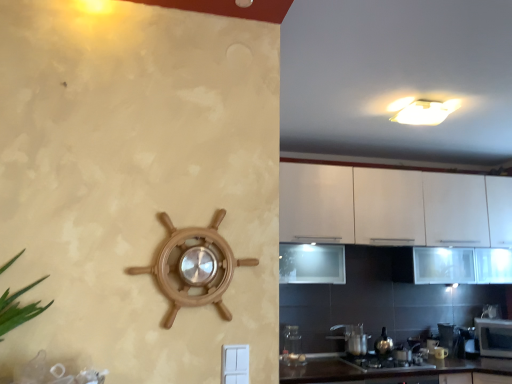
Question: Which is correct: black glossy countertop at lower center is inside transparent glass jar at lower center, arranged as the 5th appliance when viewed from the back, or outside of it?

Choices:
 (A) inside
 (B) outside

Answer: (B)

Question: From the image's perspective, is black glossy countertop at lower center located above or below transparent glass jar at lower center, arranged as the 5th appliance when viewed from the back?

Choices:
 (A) above
 (B) below

Answer: (B)

Question: Estimate the real-world distances between objects in this image. Which object is closer to the metallic silver gas stove at lower center?

Choices:
 (A) metallic silver kettle at lower right, the 3th appliance positioned from the bottom
 (B) silver metallic microwave at lower right
 (C) black glossy countertop at lower center
 (D) metallic silver toaster at lower right, the second appliance when ordered from back to front
 (E) metallic silver kettle at lower right, which appears as the 6th appliance when viewed from the front

Answer: (A)

Question: Which object is the closest to the transparent glass jar at lower center, which is the 5th appliance from right to left?

Choices:
 (A) metallic silver kettle at lower right, the 1th appliance from the back
 (B) black glossy countertop at lower center
 (C) metallic silver gas stove at lower center
 (D) metallic silver kettle at lower right, which is counted as the 4th appliance, starting from the top
 (E) wooden ship wheel at center, arranged as the first appliance when viewed from the front

Answer: (B)